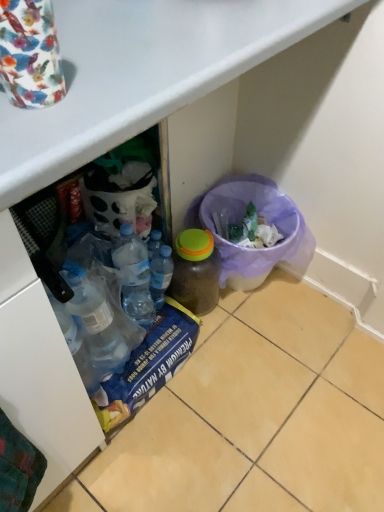
Question: From the image's perspective, is purple mesh bin at lower right located above or below transparent plastic bottle at center, acting as the 1th bottle starting from the left?

Choices:
 (A) above
 (B) below

Answer: (A)

Question: Looking at their shapes, would you say purple mesh bin at lower right is wider or thinner than transparent plastic bottle at center, acting as the 1th bottle starting from the left?

Choices:
 (A) thin
 (B) wide

Answer: (B)

Question: Which object is positioned farthest from the purple mesh bin at lower right?

Choices:
 (A) translucent plastic bottle at center, placed as the 2th bottle when sorted from left to right
 (B) transparent plastic bottle at center, acting as the 1th bottle starting from the left

Answer: (B)

Question: Which object is positioned farthest from the translucent plastic bottle at center, placed as the 2th bottle when sorted from left to right?

Choices:
 (A) purple mesh bin at lower right
 (B) transparent plastic bottle at center, which appears as the 2th bottle when viewed from the right

Answer: (A)